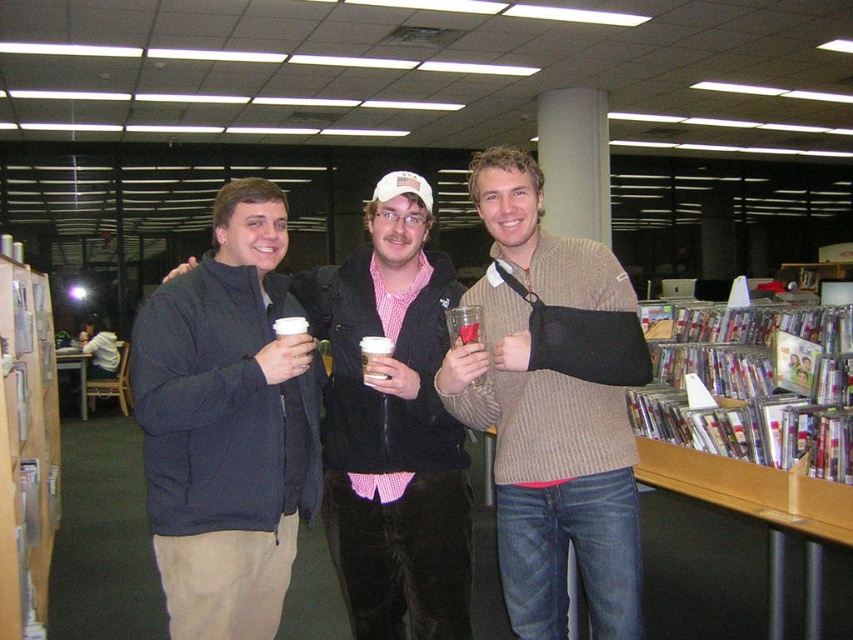
Which is more to the left, dark blue fleece jacket at left or knit sweater at center?

dark blue fleece jacket at left

Is dark blue fleece jacket at left to the left of knit sweater at center from the viewer's perspective?

Correct, you'll find dark blue fleece jacket at left to the left of knit sweater at center.

Identify the location of dark blue fleece jacket at left. This screenshot has width=853, height=640. (227, 422).

I want to click on dark blue fleece jacket at left, so click(x=227, y=422).

Based on the photo, is knit sweater at center bigger than dark blue jacket at center?

Incorrect, knit sweater at center is not larger than dark blue jacket at center.

Does knit sweater at center appear on the right side of dark blue jacket at center?

Yes, knit sweater at center is to the right of dark blue jacket at center.

You are a GUI agent. You are given a task and a screenshot of the screen. Output one action in this format:
    pyautogui.click(x=<x>, y=<y>)
    Task: Click on the knit sweater at center
    The height and width of the screenshot is (640, 853).
    Given the screenshot: What is the action you would take?
    pyautogui.click(x=547, y=413)

Is dark blue fleece jacket at left further to camera compared to dark blue jacket at center?

No, dark blue fleece jacket at left is in front of dark blue jacket at center.

Who is more forward, (219,584) or (422,198)?

Point (219,584)

Where is `dark blue fleece jacket at left`? Image resolution: width=853 pixels, height=640 pixels. dark blue fleece jacket at left is located at coordinates (227, 422).